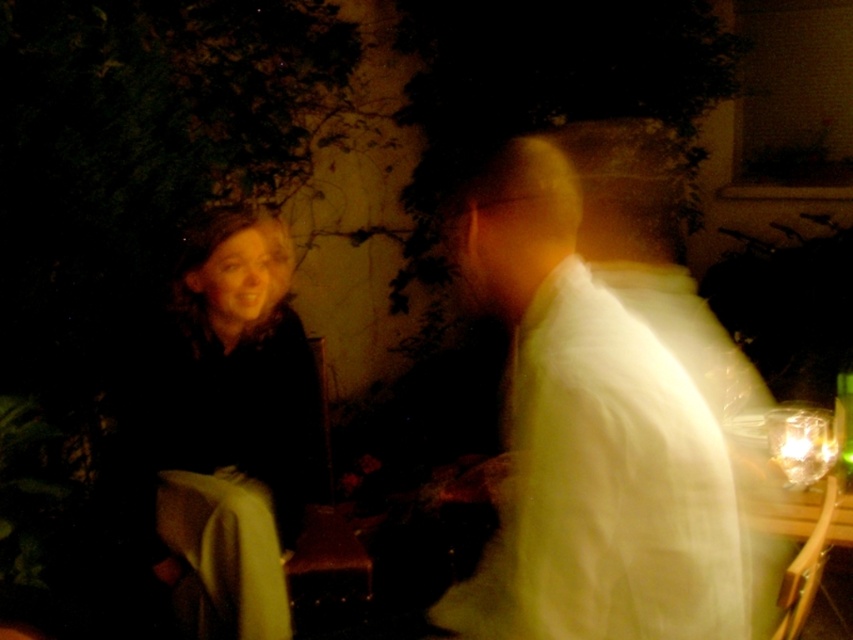
Consider the image. You are at a nighttime event and see the white matte shirt at center and the dark brown fabric coat at left. Which object is shorter?

The white matte shirt at center is shorter than the dark brown fabric coat at left.

You are at a candlelit event and see two people wearing white shirts. One is the white glossy shirt at upper right and the other is the white matte shirt at center. Which of these two shirts is located to the right of the other?

The white glossy shirt at upper right is positioned on the right side of the white matte shirt at center.

You are at a nighttime event and see the white glossy shirt at upper right and the dark brown fabric coat at left. Which one appears taller in the image?

The white glossy shirt at upper right is much taller than the dark brown fabric coat at left.